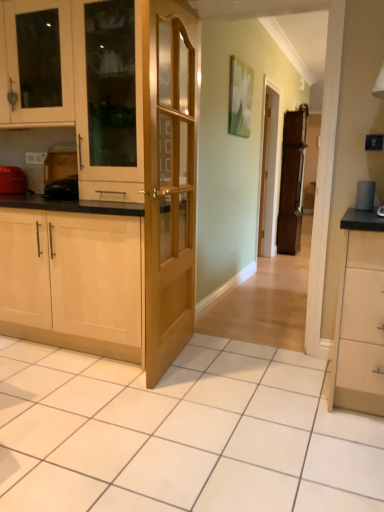
The width and height of the screenshot is (384, 512). What do you see at coordinates (292, 181) in the screenshot?
I see `brown wooden fridge at center` at bounding box center [292, 181].

Locate an element on the screen. matte wood cabinet at center, which is the 2th cabinetry from bottom to top is located at coordinates (108, 89).

Locate an element on the screen. light wood/glass door at center is located at coordinates (168, 187).

This screenshot has width=384, height=512. Describe the element at coordinates (268, 170) in the screenshot. I see `matte wooden screen door at center` at that location.

You are a GUI agent. You are given a task and a screenshot of the screen. Output one action in this format:
    pyautogui.click(x=<x>, y=<y>)
    Task: Click on the brown wooden fridge at center
    
    Given the screenshot: What is the action you would take?
    pyautogui.click(x=292, y=181)

Is brown wooden fridge at center to the left or to the right of light wood/wooden cabinet at left, the 3th cabinetry when ordered from top to bottom, in the image?

Clearly, brown wooden fridge at center is on the right of light wood/wooden cabinet at left, the 3th cabinetry when ordered from top to bottom, in the image.

Is brown wooden fridge at center positioned far away from light wood/wooden cabinet at left, the 3th cabinetry when ordered from top to bottom?

Yes, brown wooden fridge at center and light wood/wooden cabinet at left, the 3th cabinetry when ordered from top to bottom, are quite far apart.

Does brown wooden fridge at center have a lesser width compared to light wood/wooden cabinet at left, the 3th cabinetry when ordered from top to bottom?

Indeed, brown wooden fridge at center has a lesser width compared to light wood/wooden cabinet at left, the 3th cabinetry when ordered from top to bottom.

From the image's perspective, which object appears higher, brown wooden fridge at center or light wood/wooden cabinet at left, which is the 1th cabinetry in bottom-to-top order?

brown wooden fridge at center is shown above in the image.

Considering the relative sizes of brown wooden fridge at center and light wood/glass door at center in the image provided, is brown wooden fridge at center taller than light wood/glass door at center?

In fact, brown wooden fridge at center may be shorter than light wood/glass door at center.

Considering the sizes of objects brown wooden fridge at center and light wood/glass door at center in the image provided, who is bigger, brown wooden fridge at center or light wood/glass door at center?

brown wooden fridge at center is bigger.

Is point (291, 230) closer or farther from the camera than point (170, 160)?

Point (291, 230).

Is brown wooden fridge at center looking in the opposite direction of light wood/glass door at center?

That's not correct — brown wooden fridge at center is not looking away from light wood/glass door at center.

Considering the sizes of objects matte wooden screen door at center and matte red toaster at left in the image provided, who is shorter, matte wooden screen door at center or matte red toaster at left?

With less height is matte red toaster at left.

Between matte wooden screen door at center and matte red toaster at left, which one appears on the left side from the viewer's perspective?

matte red toaster at left is more to the left.

Considering the relative sizes of matte wooden screen door at center and matte red toaster at left in the image provided, is matte wooden screen door at center smaller than matte red toaster at left?

Actually, matte wooden screen door at center might be larger than matte red toaster at left.

Is matte wooden screen door at center oriented towards matte red toaster at left?

No, matte wooden screen door at center is not oriented towards matte red toaster at left.

Considering the sizes of objects light wood/glass door at center and brown wooden fridge at center in the image provided, who is bigger, light wood/glass door at center or brown wooden fridge at center?

brown wooden fridge at center.

Which of these two, light wood/glass door at center or brown wooden fridge at center, stands taller?

With more height is light wood/glass door at center.

Which object is closer to the camera taking this photo, light wood/glass door at center or brown wooden fridge at center?

light wood/glass door at center is closer to the camera.

What's the angular difference between light wood/glass door at center and brown wooden fridge at center's facing directions?

4.51 degrees separate the facing orientations of light wood/glass door at center and brown wooden fridge at center.

Is point (260, 218) closer to viewer compared to point (38, 28)?

No, it is behind (38, 28).

Would you say matte wooden screen door at center is inside or outside white glossy cabinet at upper left, which is the third cabinetry from bottom to top?

matte wooden screen door at center exists outside the volume of white glossy cabinet at upper left, which is the third cabinetry from bottom to top.

From the image's perspective, relative to white glossy cabinet at upper left, which is the third cabinetry from bottom to top, is matte wooden screen door at center above or below?

Clearly, from the image's perspective, matte wooden screen door at center is below white glossy cabinet at upper left, which is the third cabinetry from bottom to top.

Looking at this image, which is correct: matte red toaster at left is inside brown wooden fridge at center, or outside of it?

matte red toaster at left is not enclosed by brown wooden fridge at center.

Where is `appliance positioned vertically above the brown wooden fridge at center (from a real-world perspective)`? The width and height of the screenshot is (384, 512). appliance positioned vertically above the brown wooden fridge at center (from a real-world perspective) is located at coordinates (12, 180).

Is the surface of matte red toaster at left in direct contact with brown wooden fridge at center?

No, matte red toaster at left is not making contact with brown wooden fridge at center.

Considering the positions of point (20, 175) and point (283, 196), is point (20, 175) closer or farther from the camera than point (283, 196)?

Point (20, 175) is positioned closer to the camera compared to point (283, 196).

Is the position of light wood/wooden cabinet at left, which is the 1th cabinetry in bottom-to-top order, more distant than that of light wood/glass door at center?

Yes, light wood/wooden cabinet at left, which is the 1th cabinetry in bottom-to-top order, is behind light wood/glass door at center.

From the image's perspective, which one is positioned higher, light wood/wooden cabinet at left, which is the 1th cabinetry in bottom-to-top order, or light wood/glass door at center?

light wood/glass door at center is shown above in the image.

Can you tell me how much light wood/wooden cabinet at left, which is the 1th cabinetry in bottom-to-top order, and light wood/glass door at center differ in facing direction?

The facing directions of light wood/wooden cabinet at left, which is the 1th cabinetry in bottom-to-top order, and light wood/glass door at center are 96 degrees apart.

In order to click on fridge on the right side of light wood/wooden cabinet at left, which is the 1th cabinetry in bottom-to-top order in this screenshot , I will do `click(292, 181)`.

In order to click on door that appears below the brown wooden fridge at center (from the image's perspective) in this screenshot , I will do `click(168, 187)`.

Looking at this image, looking at the image, which one is located further to light wood/glass door at center, white glossy cabinet at upper left, marked as the first cabinetry in a top-to-bottom arrangement, or light wood/wooden cabinet at left, which is the 1th cabinetry in bottom-to-top order?

white glossy cabinet at upper left, marked as the first cabinetry in a top-to-bottom arrangement, is further to light wood/glass door at center.

From the image, which object appears to be farther from matte red toaster at left, matte wooden screen door at center or light wood/glass door at center?

matte wooden screen door at center.

When comparing their distances from light wood/glass door at center, does matte wooden screen door at center or matte red toaster at left seem further?

The object further to light wood/glass door at center is matte wooden screen door at center.

Estimate the real-world distances between objects in this image. Which object is closer to white glossy cabinet at upper left, marked as the first cabinetry in a top-to-bottom arrangement, matte wooden screen door at center or light wood/glass door at center?

The object closer to white glossy cabinet at upper left, marked as the first cabinetry in a top-to-bottom arrangement, is light wood/glass door at center.

Which object lies further to the anchor point matte red toaster at left, brown wooden fridge at center or matte wood cabinet at center, which is the 2th cabinetry from bottom to top?

Based on the image, brown wooden fridge at center appears to be further to matte red toaster at left.

Which object lies nearer to the anchor point matte wood cabinet at center, which is the 2th cabinetry from bottom to top, light wood/glass door at center or light wood/wooden cabinet at left, the 3th cabinetry when ordered from top to bottom?

light wood/glass door at center.

Looking at the image, which one is located further to matte red toaster at left, matte wood cabinet at center, marked as the 2th cabinetry in a top-to-bottom arrangement, or white glossy cabinet at upper left, which is the third cabinetry from bottom to top?

matte wood cabinet at center, marked as the 2th cabinetry in a top-to-bottom arrangement, is positioned further to the anchor matte red toaster at left.

When comparing their distances from white glossy cabinet at upper left, which is the third cabinetry from bottom to top, does matte wooden screen door at center or matte red toaster at left seem further?

matte wooden screen door at center is further to white glossy cabinet at upper left, which is the third cabinetry from bottom to top.

Where is `cabinetry between matte wood cabinet at center, marked as the 2th cabinetry in a top-to-bottom arrangement, and brown wooden fridge at center, along the z-axis`? The width and height of the screenshot is (384, 512). cabinetry between matte wood cabinet at center, marked as the 2th cabinetry in a top-to-bottom arrangement, and brown wooden fridge at center, along the z-axis is located at coordinates (36, 62).

Locate an element on the screen. Image resolution: width=384 pixels, height=512 pixels. door between matte wood cabinet at center, which is the 2th cabinetry from bottom to top, and light wood/wooden cabinet at left, the 3th cabinetry when ordered from top to bottom, in the vertical direction is located at coordinates (168, 187).

What are the coordinates of `screen door between white glossy cabinet at upper left, which is the third cabinetry from bottom to top, and brown wooden fridge at center, along the z-axis` in the screenshot? It's located at (268, 170).

Identify the location of cabinetry between matte wood cabinet at center, marked as the 2th cabinetry in a top-to-bottom arrangement, and matte wooden screen door at center from front to back. The image size is (384, 512). (36, 62).